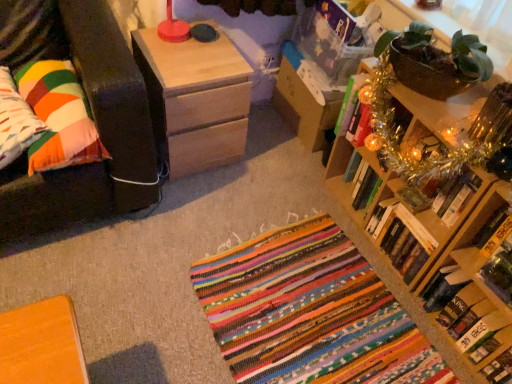
At what (x,y) coordinates should I click in order to perform the action: click on vacant area that lies between hardcover book at lower right, marked as the 1th book in a bottom-to-top arrangement, and natural wood nightstand at upper left. Please return your answer as a coordinate pair (x, y). Image resolution: width=512 pixels, height=384 pixels. Looking at the image, I should click on (296, 223).